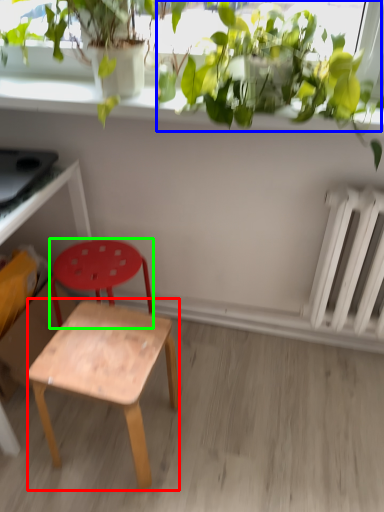
Question: Which object is positioned closest to stool (highlighted by a red box)? Select from vegetation (highlighted by a blue box) and stool (highlighted by a green box).

Choices:
 (A) vegetation
 (B) stool

Answer: (B)